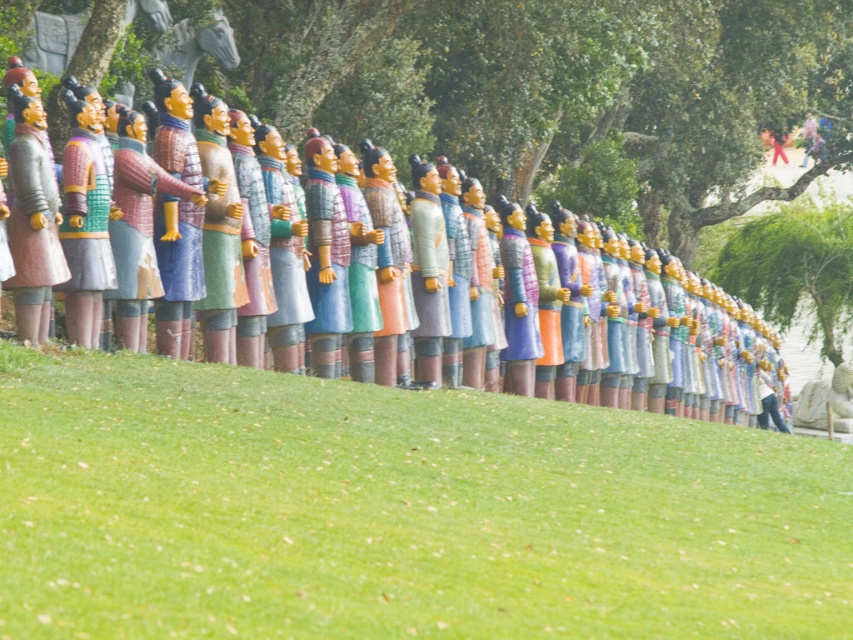
You are standing at the base of the slope where the green grass at lower center is located. You want to take a photo of the green leafy tree at upper center without any obstruction. Considering their sizes, which object should you move closer to or farther from to achieve this?

Since the green grass at lower center is smaller than the green leafy tree at upper center, you should move closer to the green grass at lower center to reduce its prominence in the frame, allowing the larger tree to be the main focus without obstruction.

You are a gardener who needs to mow the lawn. You see the green grass at lower center and the matte painted statue at center. Which area requires more attention in terms of space coverage for mowing?

The green grass at lower center requires less attention in terms of space coverage for mowing since it occupies less space than the matte painted statue at center.